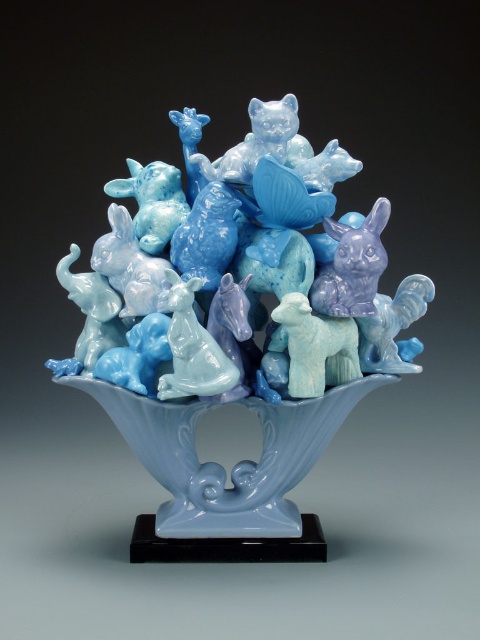
Question: Is matte porcelain animals at center above light blue glass bowl at center?

Choices:
 (A) no
 (B) yes

Answer: (B)

Question: Among these points, which one is nearest to the camera?

Choices:
 (A) (177, 486)
 (B) (159, 349)

Answer: (B)

Question: Does matte porcelain animals at center appear on the right side of light blue glass bowl at center?

Choices:
 (A) no
 (B) yes

Answer: (A)

Question: Is matte porcelain animals at center to the left of light blue glass bowl at center from the viewer's perspective?

Choices:
 (A) no
 (B) yes

Answer: (B)

Question: Among these points, which one is farthest from the camera?

Choices:
 (A) (158, 339)
 (B) (317, 403)

Answer: (B)